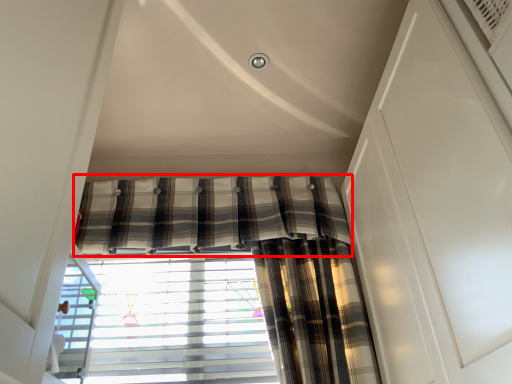
Question: In this image, where is curtain (annotated by the red box) located relative to window blind?

Choices:
 (A) left
 (B) right

Answer: (B)